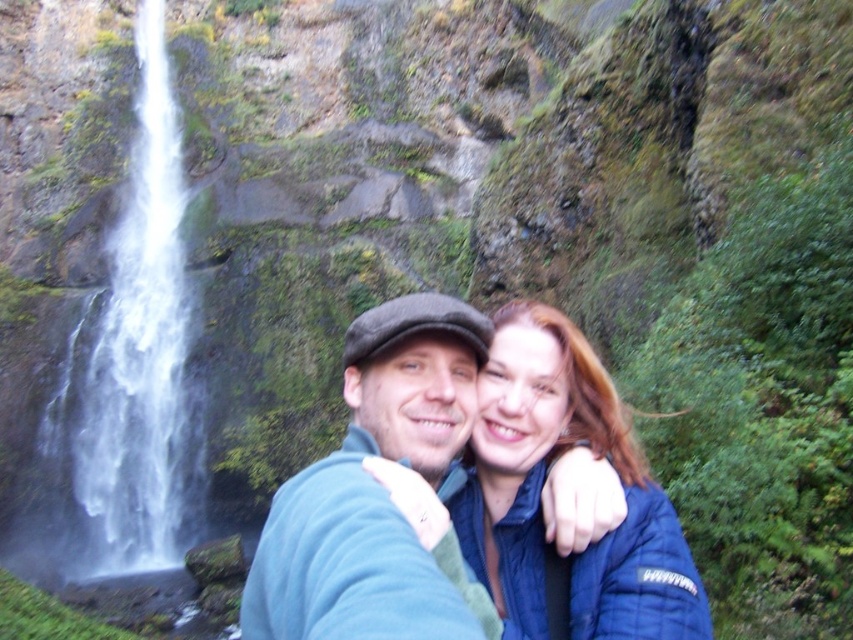
You are a photographer trying to frame a shot of the two people in the image. The blue fleece jacket at center is important for the composition. Where should you position the camera to ensure the jacket is centered in the frame?

To center the blue fleece jacket at center in the frame, position the camera so that the jacket is located at the coordinates point (x=374, y=486).

Consider the image. You are a photographer trying to capture the blue fleece jacket at center in a new photo. The camera is set to focus on the point at coordinates point (x=374, y=486). Will this point be on the blue fleece jacket at center?

Yes, the point (x=374, y=486) is on the blue fleece jacket at center according to the description.